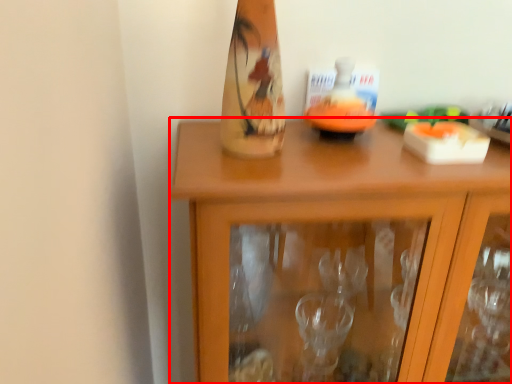
Question: From the image, what is the correct spatial relationship of cabinetry (annotated by the red box) in relation to candle holder?

Choices:
 (A) right
 (B) left

Answer: (A)